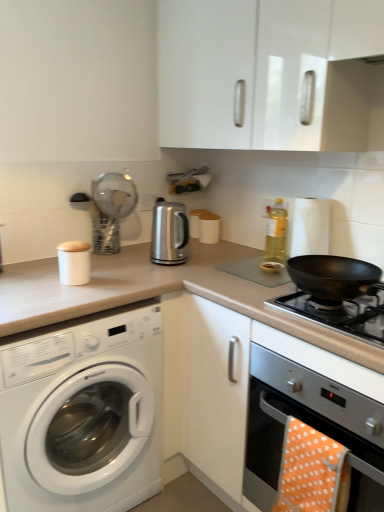
Locate an element on the screen. This screenshot has height=512, width=384. free space to the right of satin silver kettle at center, arranged as the third appliance when viewed from the left is located at coordinates (219, 257).